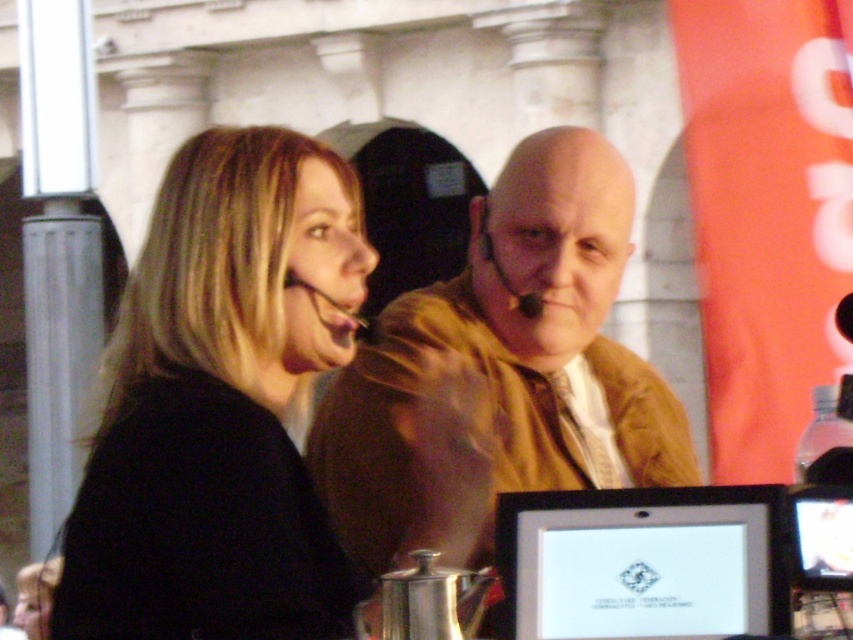
You are organizing a virtual conference and need to adjust the camera framing to focus on both the black matte jacket at center and the silver metallic laptop at center. Given their distance apart, what is the minimum zoom level required to ensure both are fully visible in the frame?

The black matte jacket at center is 10.30 meters from the silver metallic laptop at center. To ensure both are fully visible, the camera should be zoomed out to accommodate the 10.30 meters distance between them.

You are organizing a small conference and need to place a name tag on the table between the black matte jacket at center and the silver metallic laptop at center. Since the name tag is 12 inches wide, will it fit between them without overlapping either object?

The black matte jacket at center is wider than the silver metallic laptop at center. Since the name tag is 12 inches wide, it depends on the actual space between them. However, the description only states the jacket is wider but does not provide the exact distance. Without knowing the exact spacing, we cannot confirm if the name tag will fit.